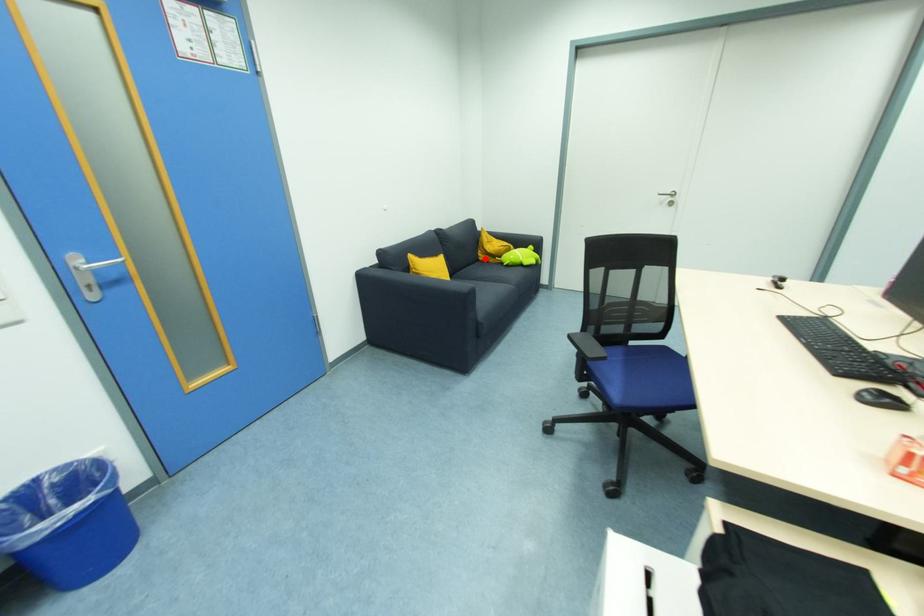
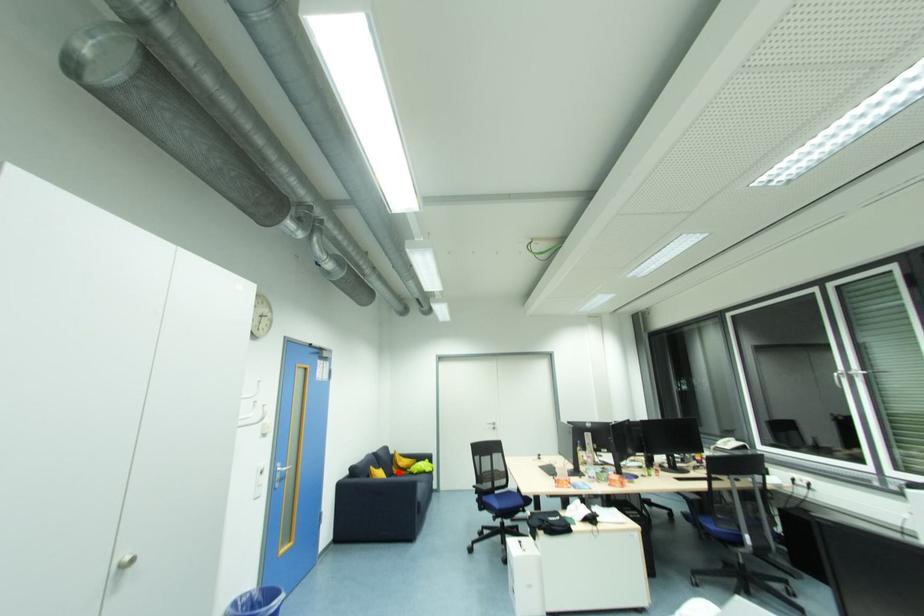
I am providing you with two images of the same scene from different viewpoints. A red point is marked on the first image and another point is marked on the second image. Do the highlighted points in image1 and image2 indicate the same real-world spot?

Yes